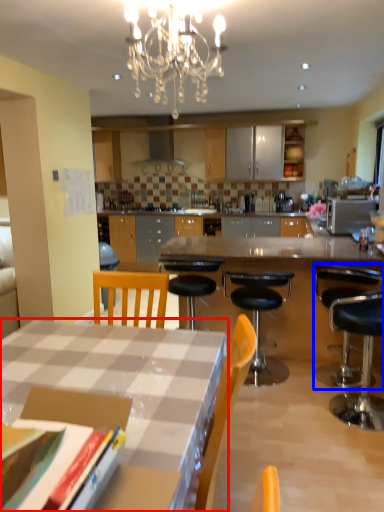
Question: Which point is closer to the camera, desk (highlighted by a red box) or chair (highlighted by a blue box)?

Choices:
 (A) desk
 (B) chair

Answer: (A)